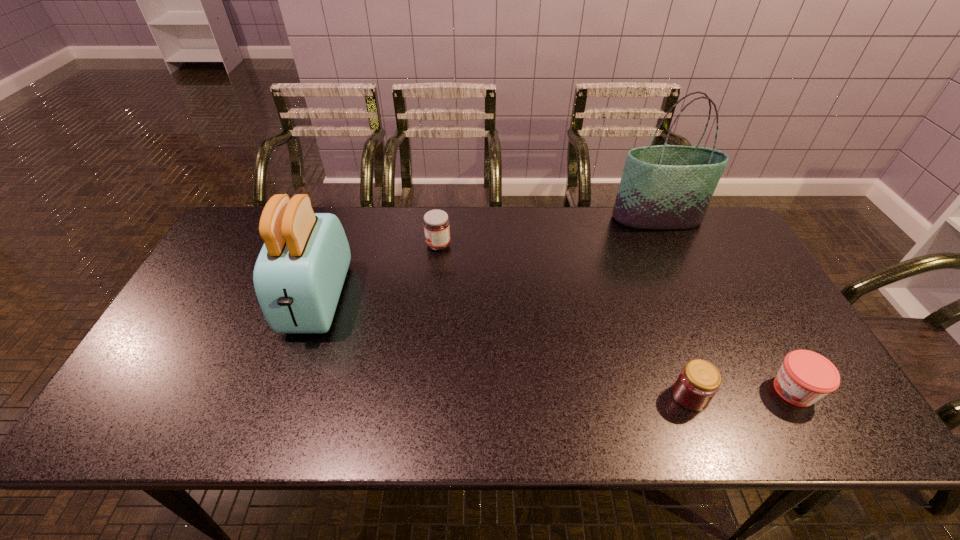
This screenshot has height=540, width=960. Identify the location of vacant space located on the left of the second object from left to right. (388, 245).

Identify the location of blank space located on the back of the second jam from right to left. Image resolution: width=960 pixels, height=540 pixels. pyautogui.click(x=670, y=342).

The width and height of the screenshot is (960, 540). Identify the location of blank space located on the front label of the rightmost jam. (728, 390).

In order to click on vacant space located on the front label of the rightmost jam in this screenshot , I will do `click(698, 390)`.

Where is `blank space located on the front label of the rightmost jam`? The image size is (960, 540). blank space located on the front label of the rightmost jam is located at coordinates (736, 390).

What are the coordinates of `tote bag located at the far edge` in the screenshot? It's located at (665, 187).

What are the coordinates of `jam located at the far edge` in the screenshot? It's located at (436, 223).

Where is `tote bag positioned at the right edge`? Image resolution: width=960 pixels, height=540 pixels. tote bag positioned at the right edge is located at coordinates (665, 187).

The height and width of the screenshot is (540, 960). Identify the location of jam located at the right edge. (804, 377).

Where is `object that is at the far right corner`? The height and width of the screenshot is (540, 960). object that is at the far right corner is located at coordinates (665, 187).